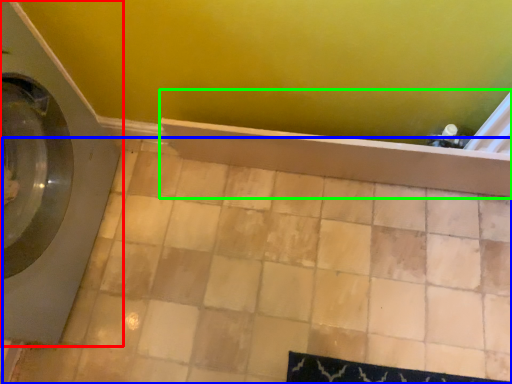
Question: Which object is the farthest from washing machine (highlighted by a red box)? Choose among these: ceramic tile (highlighted by a blue box) or bath (highlighted by a green box).

Choices:
 (A) ceramic tile
 (B) bath

Answer: (B)